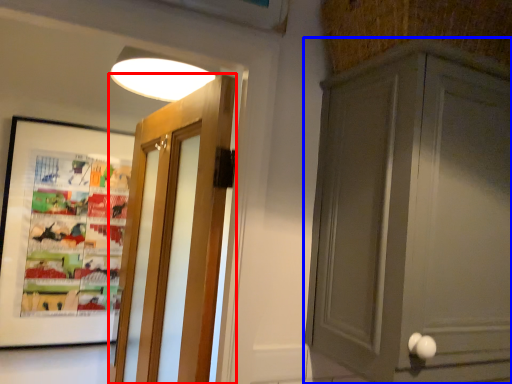
Question: Among these objects, which one is nearest to the camera, door (highlighted by a red box) or cabinetry (highlighted by a blue box)?

Choices:
 (A) door
 (B) cabinetry

Answer: (B)